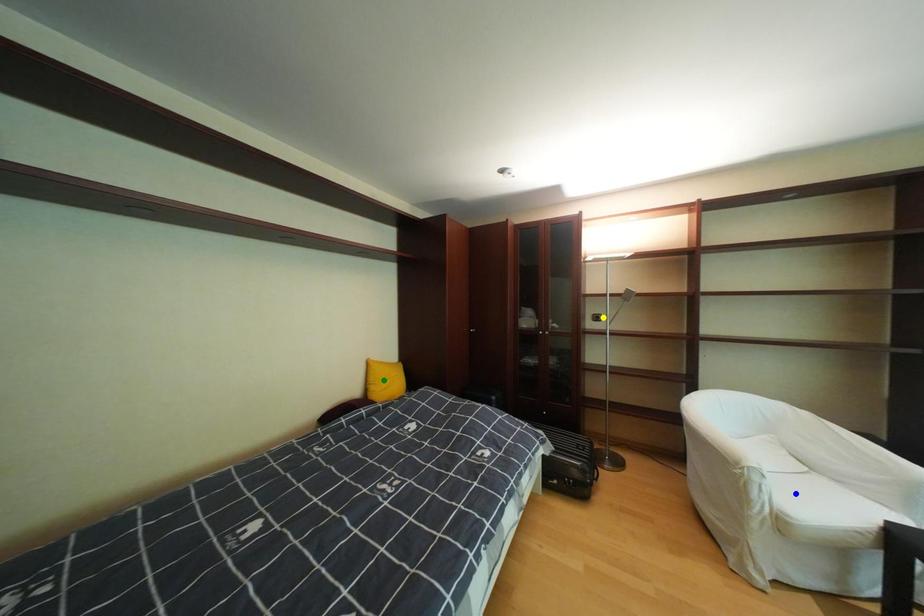
Order these from nearest to farthest:
yellow point | blue point | green point

blue point → yellow point → green point